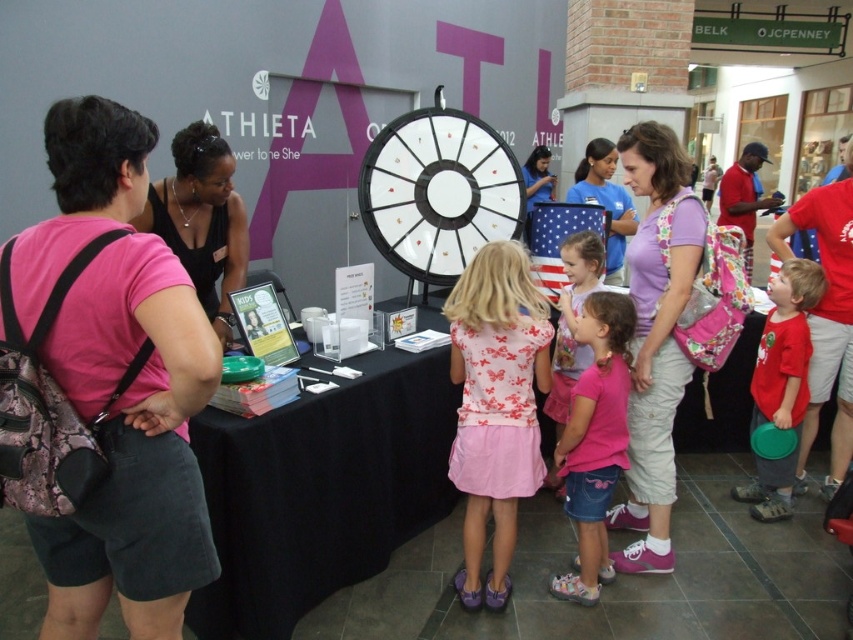
Question: Which point appears farthest from the camera in this image?

Choices:
 (A) (607, 195)
 (B) (548, 200)
 (C) (639, 499)

Answer: (B)

Question: Does pink fabric backpack at left lie in front of purple cotton shirt at center?

Choices:
 (A) no
 (B) yes

Answer: (B)

Question: Considering the real-world distances, which object is farthest from the purple floral backpack at center?

Choices:
 (A) purple cotton shirt at center
 (B) pink cotton dress at center
 (C) pink cotton shirt at center

Answer: (A)

Question: Estimate the real-world distances between objects in this image. Which object is closer to the black matte tank top at upper left?

Choices:
 (A) purple cotton shirt at center
 (B) pink cotton dress at center

Answer: (B)

Question: Can you confirm if pink fabric backpack at left is wider than blue denim shirt at center?

Choices:
 (A) no
 (B) yes

Answer: (B)

Question: Does black fabric table at center have a greater width compared to purple floral backpack at center?

Choices:
 (A) yes
 (B) no

Answer: (A)